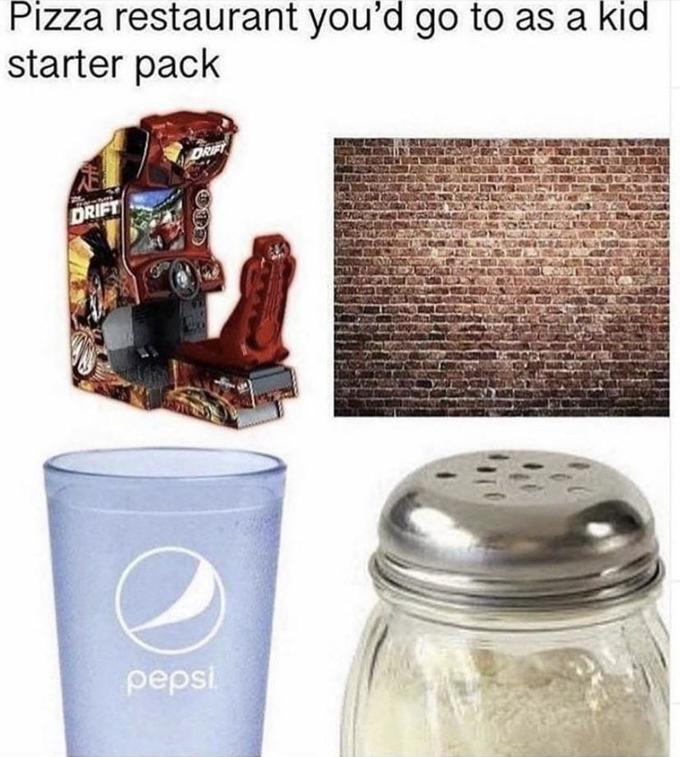
The width and height of the screenshot is (680, 757). I want to click on glass container, so click(x=524, y=696).